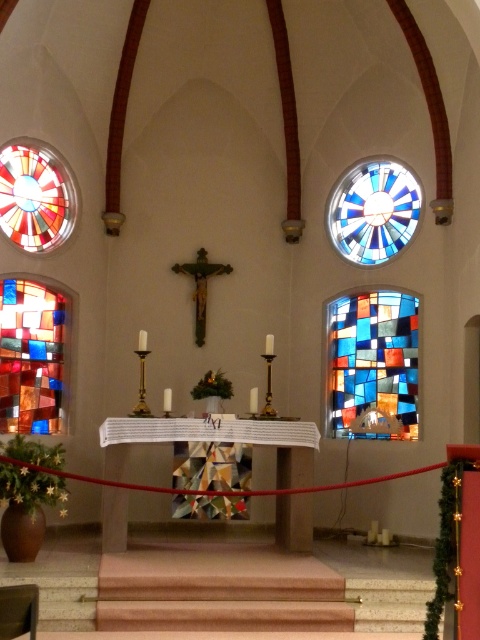
Who is higher up, stained glass window at right or stained glass window at center?

stained glass window at center is above.

Is stained glass window at right below stained glass window at center?

Yes.

Is point (377, 348) more distant than point (24, 396)?

Yes, it is.

Locate an element on the screen. stained glass window at right is located at coordinates (372, 365).

Can you confirm if stained glass window at right is positioned to the right of stained glass window at upper left?

Correct, you'll find stained glass window at right to the right of stained glass window at upper left.

Who is shorter, stained glass window at right or stained glass window at upper left?

With less height is stained glass window at upper left.

I want to click on stained glass window at right, so click(x=372, y=365).

What do you see at coordinates (215, 440) in the screenshot? I see `geometric mosaic altar at center` at bounding box center [215, 440].

This screenshot has width=480, height=640. I want to click on geometric mosaic altar at center, so click(x=215, y=440).

Identify the location of geometric mosaic altar at center. The height and width of the screenshot is (640, 480). (215, 440).